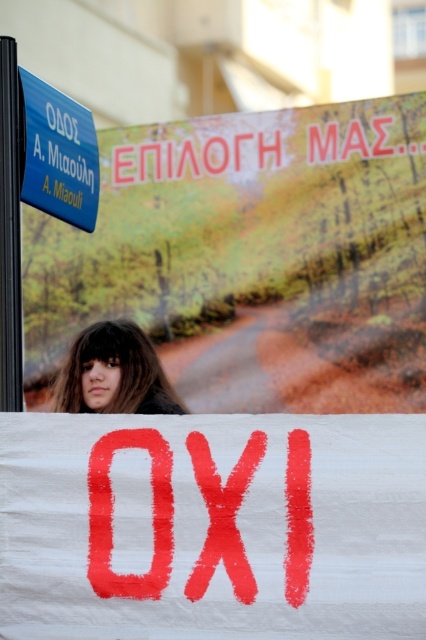
You are a photographer trying to capture the brown hair at center and the blue plastic sign at upper left in a single frame. Based on the scene, which object is located to the left of the other?

The blue plastic sign at upper left is positioned on the left side of brown hair at center, so the blue plastic sign at upper left is to the left of the brown hair at center.

From the picture: You are a photographer trying to capture a clear shot of the blue plastic sign at upper left and the brown hair at center. Given that your camera can focus on objects within a 1 meter range, will both objects be in focus at the same time?

The blue plastic sign at upper left and brown hair at center are 1.01 meters apart. Since the distance between them exceeds the camera focus range of 1 meter, they cannot both be in focus simultaneously.